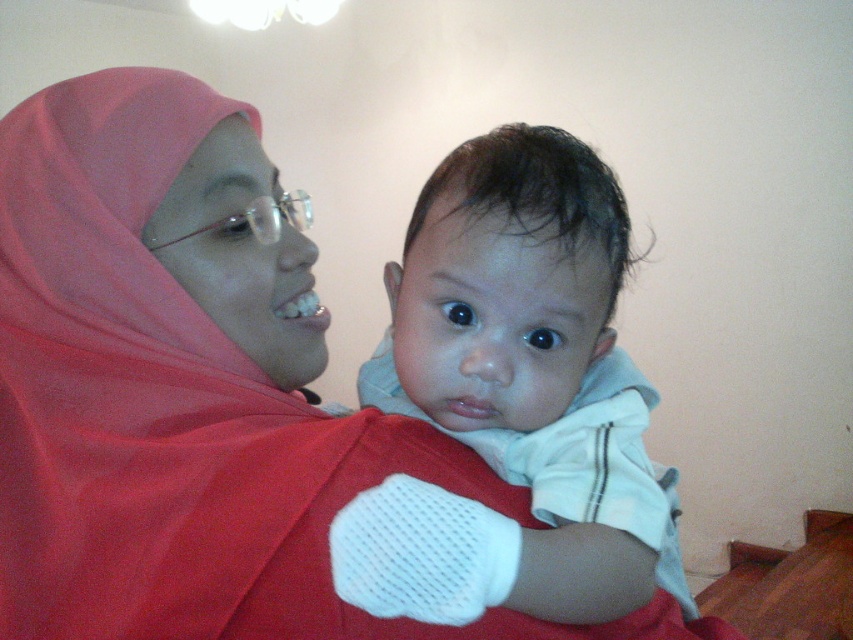
Is matte red hijab at center further to camera compared to white soft fabric baby at center?

Yes.

Which is more to the left, matte red hijab at center or white soft fabric baby at center?

matte red hijab at center

Is point (155, 141) positioned after point (570, 291)?

Yes, point (155, 141) is behind point (570, 291).

Find the location of `matte red hijab at center`. matte red hijab at center is located at coordinates (177, 412).